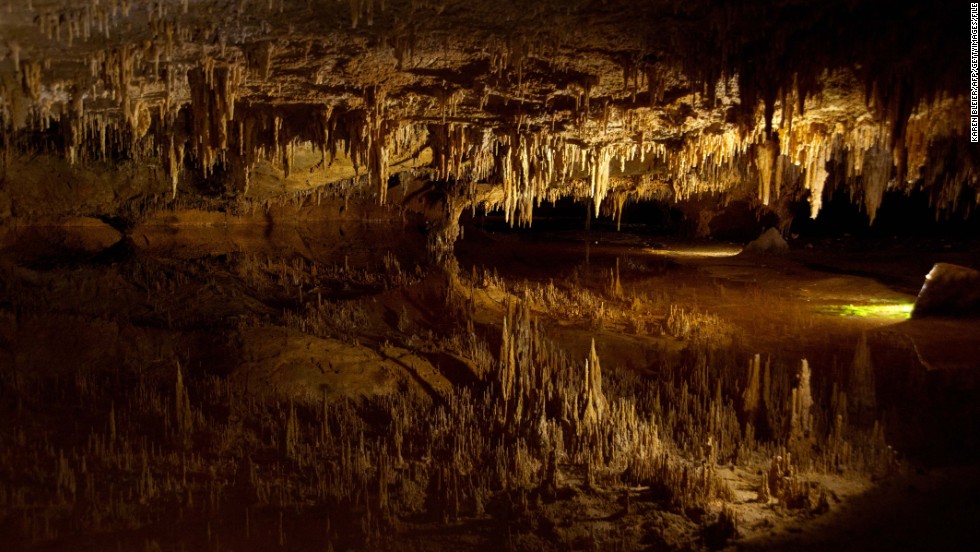
Locate an element on the screen. light is located at coordinates (905, 306).